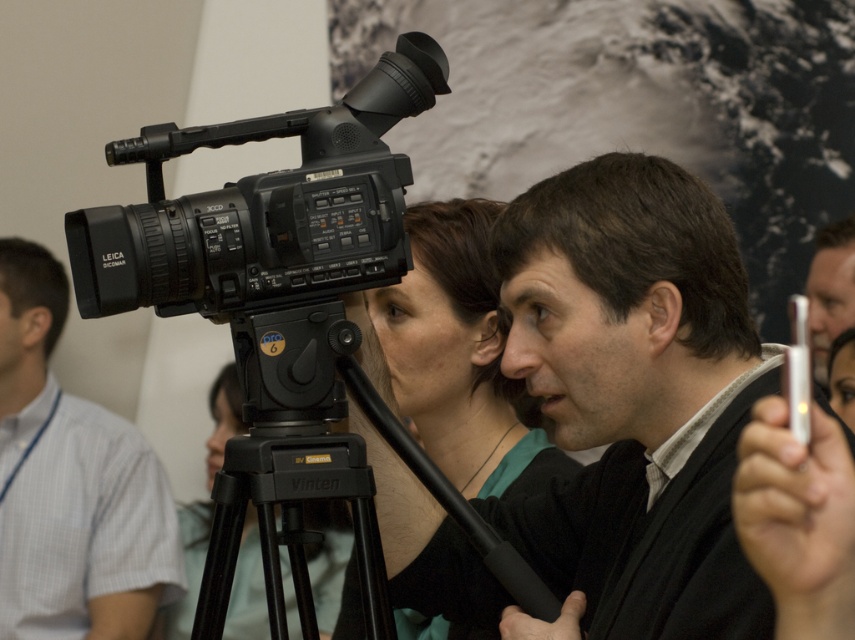
In the scene shown: Does matte black camera at upper left have a greater width compared to matte black camera at left?

No.

Who is positioned more to the left, matte black camera at upper left or matte black camera at left?

From the viewer's perspective, matte black camera at left appears more on the left side.

Describe the element at coordinates (634, 396) in the screenshot. This screenshot has height=640, width=855. I see `matte black camera at upper left` at that location.

This screenshot has width=855, height=640. I want to click on matte black camera at upper left, so click(x=634, y=396).

Can you confirm if black plastic tripod at center is smaller than matte black tripod at center?

Yes.

Is black plastic tripod at center thinner than matte black tripod at center?

Correct, black plastic tripod at center's width is less than matte black tripod at center's.

From the picture: Who is more distant from viewer, (236, 467) or (220, 436)?

Positioned behind is point (220, 436).

The image size is (855, 640). Identify the location of black plastic tripod at center. 322,470.

Can you confirm if black plastic camera at center is taller than matte black camera at left?

Incorrect, black plastic camera at center's height is not larger of matte black camera at left's.

Which of these two, black plastic camera at center or matte black camera at left, stands shorter?

Standing shorter between the two is black plastic camera at center.

Which is in front, point (335, 125) or point (65, 410)?

Positioned in front is point (335, 125).

The image size is (855, 640). Identify the location of black plastic camera at center. (264, 205).